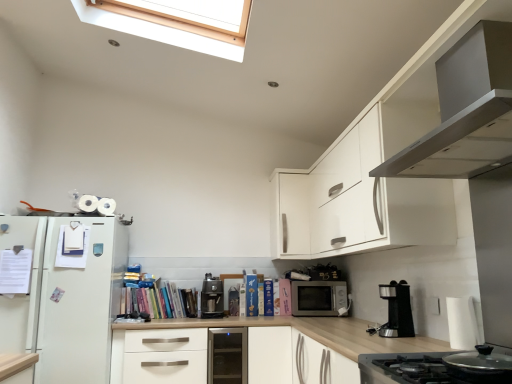
Question: Does satin silver dishwasher at center have a greater width compared to stainless steel stove at lower right, marked as the second home appliance in a top-to-bottom arrangement?

Choices:
 (A) yes
 (B) no

Answer: (B)

Question: Is satin silver dishwasher at center to the left of stainless steel stove at lower right, marked as the second home appliance in a top-to-bottom arrangement, from the viewer's perspective?

Choices:
 (A) no
 (B) yes

Answer: (B)

Question: Would you say satin silver dishwasher at center contains stainless steel stove at lower right, which appears as the 1th home appliance when ordered from the bottom?

Choices:
 (A) no
 (B) yes

Answer: (A)

Question: From the image's perspective, is satin silver dishwasher at center over stainless steel stove at lower right, marked as the second home appliance in a top-to-bottom arrangement?

Choices:
 (A) yes
 (B) no

Answer: (B)

Question: Is satin silver dishwasher at center facing away from stainless steel stove at lower right, marked as the second home appliance in a top-to-bottom arrangement?

Choices:
 (A) no
 (B) yes

Answer: (A)

Question: Based on their positions, is white matte drawer at center located to the left or right of satin black coffee machine at center, the first coffee machine in the back-to-front sequence?

Choices:
 (A) left
 (B) right

Answer: (A)

Question: Considering the positions of point (172, 342) and point (216, 301), is point (172, 342) closer or farther from the camera than point (216, 301)?

Choices:
 (A) farther
 (B) closer

Answer: (B)

Question: Looking at the image, does white matte drawer at center seem bigger or smaller compared to satin black coffee machine at center, the first coffee machine in the left-to-right sequence?

Choices:
 (A) big
 (B) small

Answer: (A)

Question: In the image, is white matte drawer at center positioned in front of or behind satin black coffee machine at center, which is the 2th coffee machine in front-to-back order?

Choices:
 (A) front
 (B) behind

Answer: (A)

Question: Is matte silver microwave at center taller or shorter than satin black coffee machine at center, the first coffee machine in the back-to-front sequence?

Choices:
 (A) tall
 (B) short

Answer: (B)

Question: Is matte silver microwave at center spatially inside satin black coffee machine at center, which is the 2th coffee machine in front-to-back order, or outside of it?

Choices:
 (A) outside
 (B) inside

Answer: (A)

Question: Is matte silver microwave at center wider or thinner than satin black coffee machine at center, the first coffee machine in the left-to-right sequence?

Choices:
 (A) thin
 (B) wide

Answer: (B)

Question: In the image, is matte silver microwave at center on the left side or the right side of satin black coffee machine at center, marked as the second coffee machine in a right-to-left arrangement?

Choices:
 (A) right
 (B) left

Answer: (A)

Question: Is hardcover books at center spatially inside white matte drawer at center, or outside of it?

Choices:
 (A) outside
 (B) inside

Answer: (A)

Question: Does point pyautogui.click(x=137, y=306) appear closer or farther from the camera than point pyautogui.click(x=122, y=370)?

Choices:
 (A) farther
 (B) closer

Answer: (A)